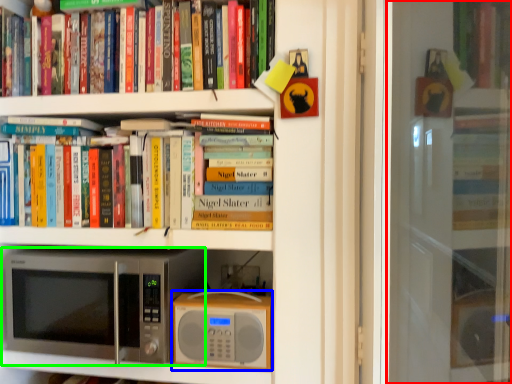
Question: Based on their relative distances, which object is farther from screen door (highlighted by a red box)? Choose from appliance (highlighted by a blue box) and microwave oven (highlighted by a green box).

Choices:
 (A) appliance
 (B) microwave oven

Answer: (B)